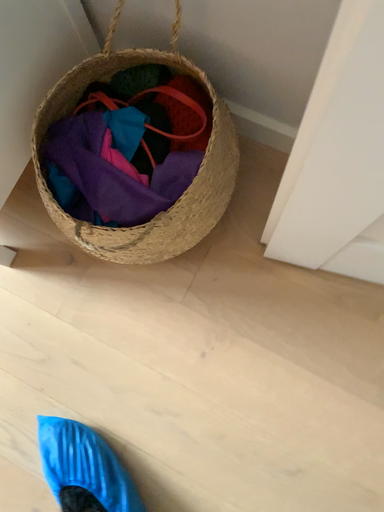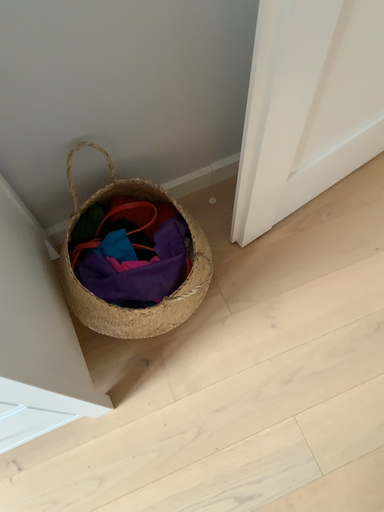
Question: How did the camera likely rotate when shooting the video?

Choices:
 (A) rotated left
 (B) rotated right

Answer: (B)